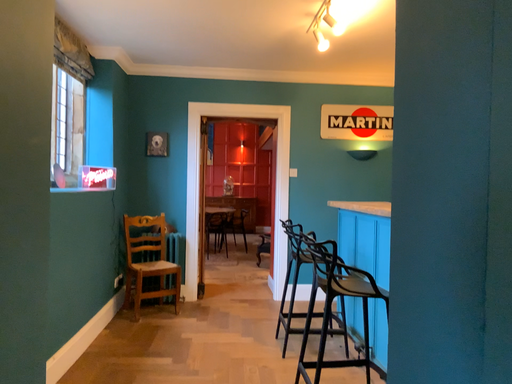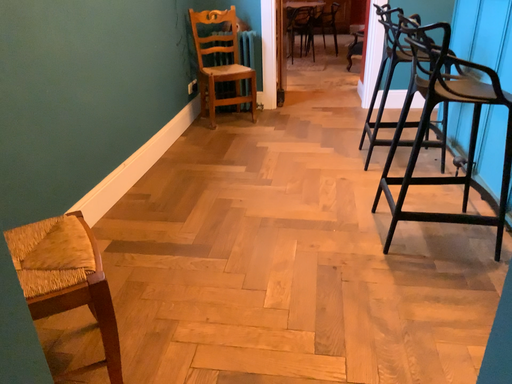
Question: Which way did the camera rotate in the video?

Choices:
 (A) rotated upward
 (B) rotated downward

Answer: (B)